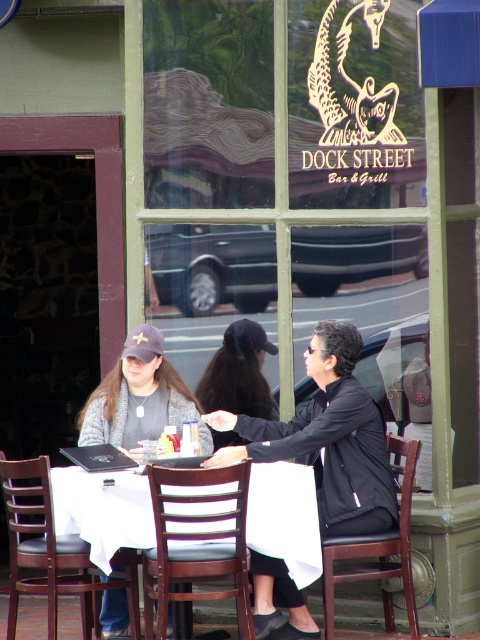
You are standing in front of the Dock Street Bar and Grill window and see the table set for two with a white tablecloth. There is a black menu holder and condiments on the table. You notice a point at coordinates (326, 438). What object is located at this point?

The point at coordinates (326, 438) corresponds to the matte black jacket at center.

You are a restaurant employee who needs to place a new menu holder on the table. The menu holder is the same size as the white cloth at lower center. Where should you place it so that it doesn not block the matte black jacket at center?

Since the matte black jacket at center is larger than the white cloth at lower center, placing the menu holder in an area away from the matte black jacket at center would ensure it does not block it. The menu holder, being the same size as the white cloth at lower center, should be positioned on the opposite side of the table or near the edge where there is more space.

You are a delivery person who needs to place a small package on the table in the scene. The table is covered with a white cloth at lower center. Where exactly should you place the package on the table to ensure it doesn not obstruct the menu holder or the condiments?

The white cloth at lower center is located at point (103, 509). To avoid obstructing the menu holder and condiments, place the package on the white cloth at lower center away from the menu holder and condiments.